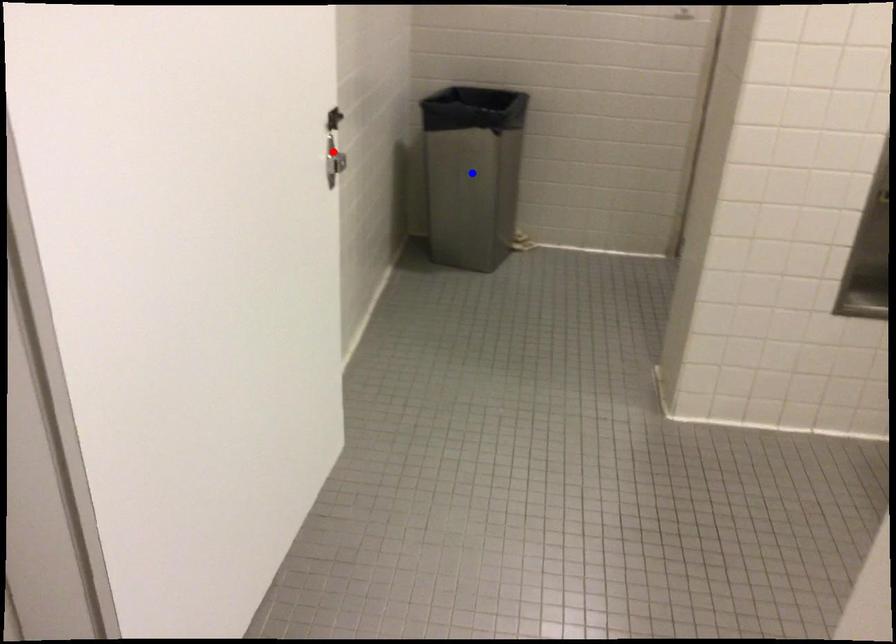
Question: In the image, two points are highlighted. Which point is nearer to the camera? Reply with the corresponding letter.

Choices:
 (A) blue point
 (B) red point

Answer: (B)